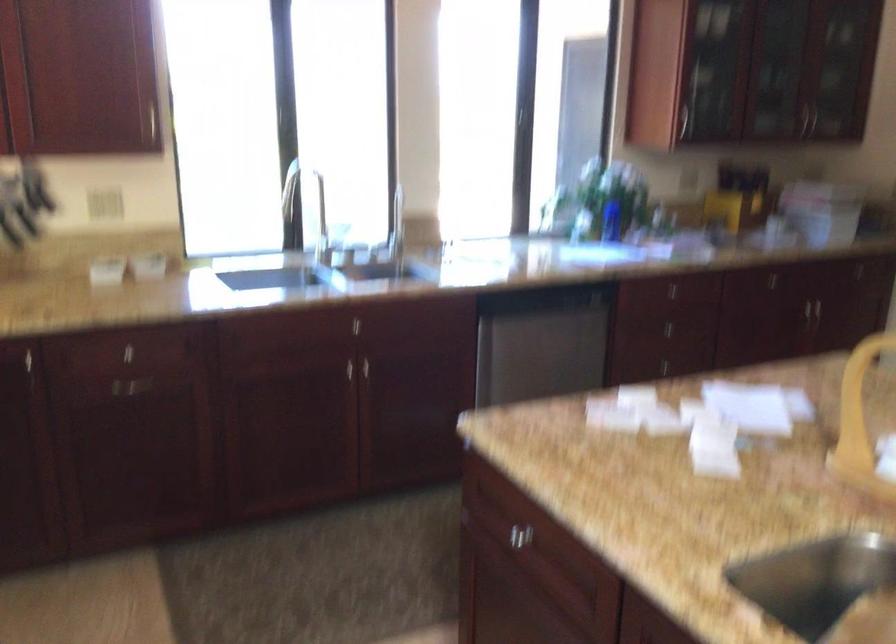
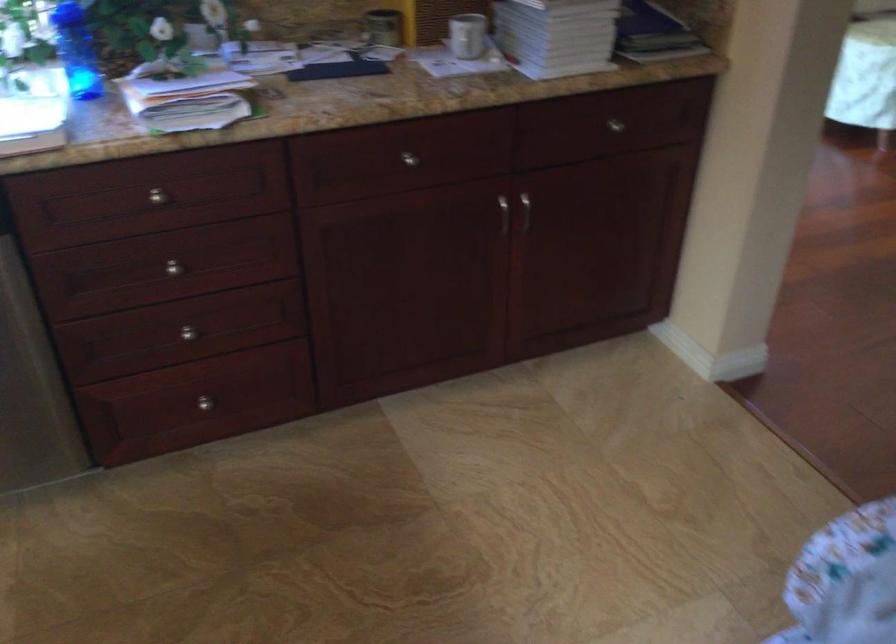
In the second image, find the point that corresponds to point (629, 216) in the first image.

(76, 51)